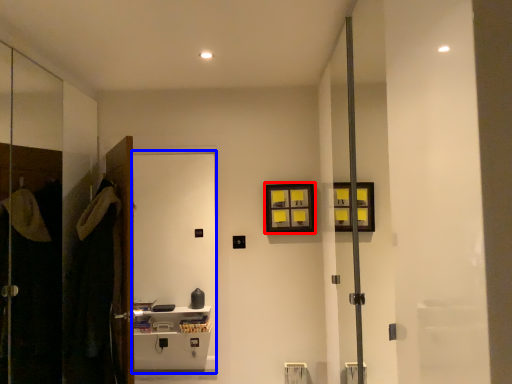
Question: Which object appears farthest to the camera in this image, picture frame (highlighted by a red box) or screen door (highlighted by a blue box)?

Choices:
 (A) picture frame
 (B) screen door

Answer: (A)